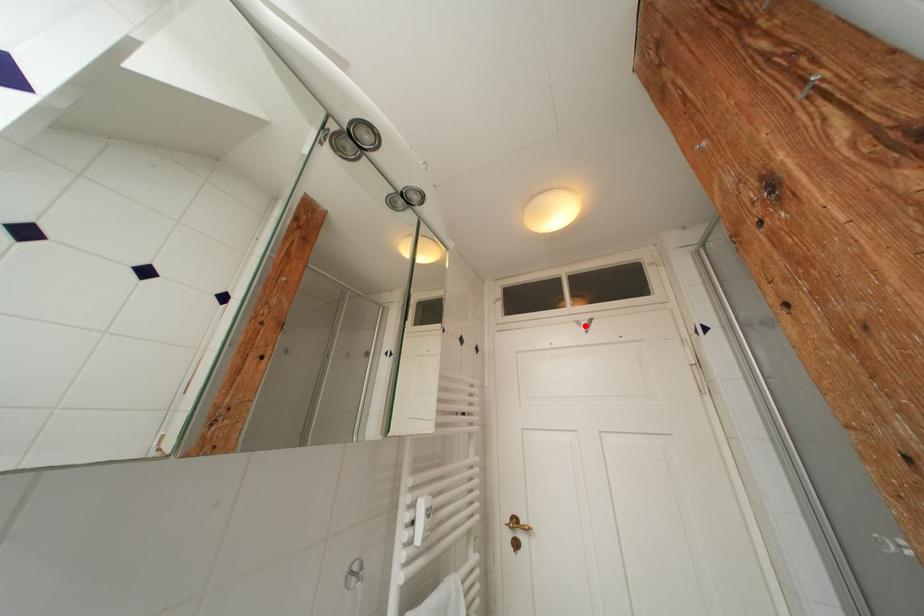
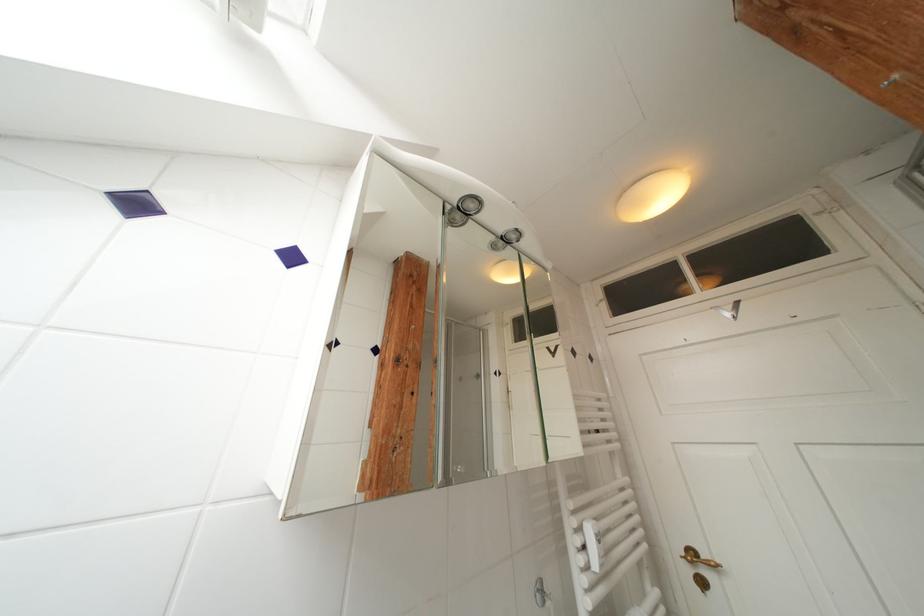
Locate, in the second image, the point that corresponds to the highlighted location in the first image.

(724, 312)